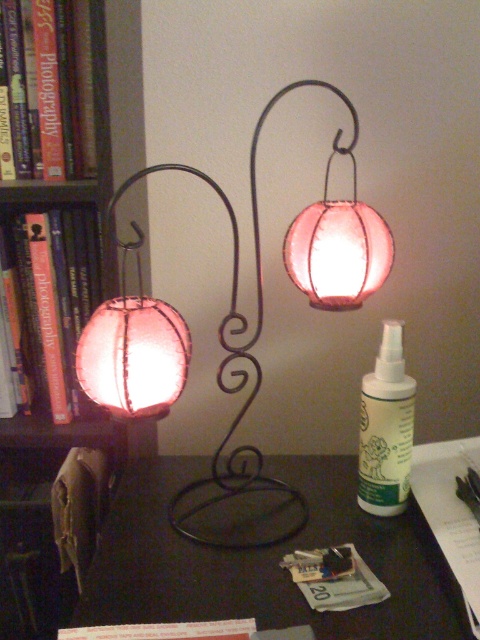
In the scene shown: Does matte wood bookshelf at left have a smaller size compared to white plastic spray bottle at center-right?

Incorrect, matte wood bookshelf at left is not smaller in size than white plastic spray bottle at center-right.

Consider the image. Which is more to the right, matte wood bookshelf at left or white plastic spray bottle at center-right?

white plastic spray bottle at center-right is more to the right.

Locate an element on the screen. The width and height of the screenshot is (480, 640). matte wood bookshelf at left is located at coordinates (60, 332).

Can you confirm if black matte table at center is bigger than matte glass lantern at center?

Actually, black matte table at center might be smaller than matte glass lantern at center.

What do you see at coordinates (266, 560) in the screenshot? The height and width of the screenshot is (640, 480). I see `black matte table at center` at bounding box center [266, 560].

What are the coordinates of `black matte table at center` in the screenshot? It's located at coord(266,560).

Is point (120, 456) closer to camera compared to point (236, 296)?

Yes, point (120, 456) is closer to viewer.

Who is more forward, (104,216) or (355,250)?

Point (355,250) is in front.

Where is `matte wood bookshelf at left`? The width and height of the screenshot is (480, 640). matte wood bookshelf at left is located at coordinates (60, 332).